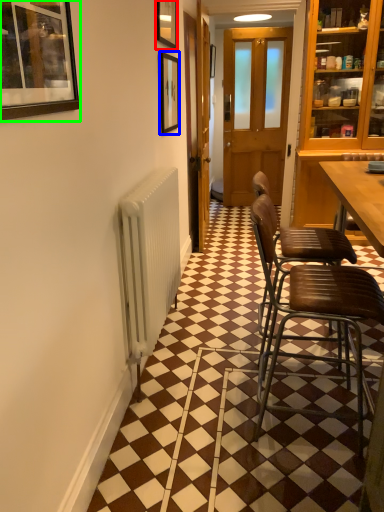
Question: Which object is positioned farthest from picture frame (highlighted by a red box)? Select from picture frame (highlighted by a blue box) and picture frame (highlighted by a green box).

Choices:
 (A) picture frame
 (B) picture frame

Answer: (B)